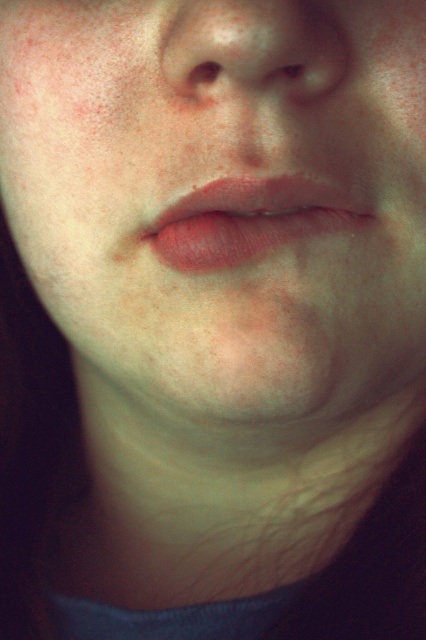
Looking at the portrait, which object occupies more space between the smooth skin nose at center and the matte skin eye at upper center?

The smooth skin nose at center occupies more space compared to the matte skin eye at upper center because it has a larger size.